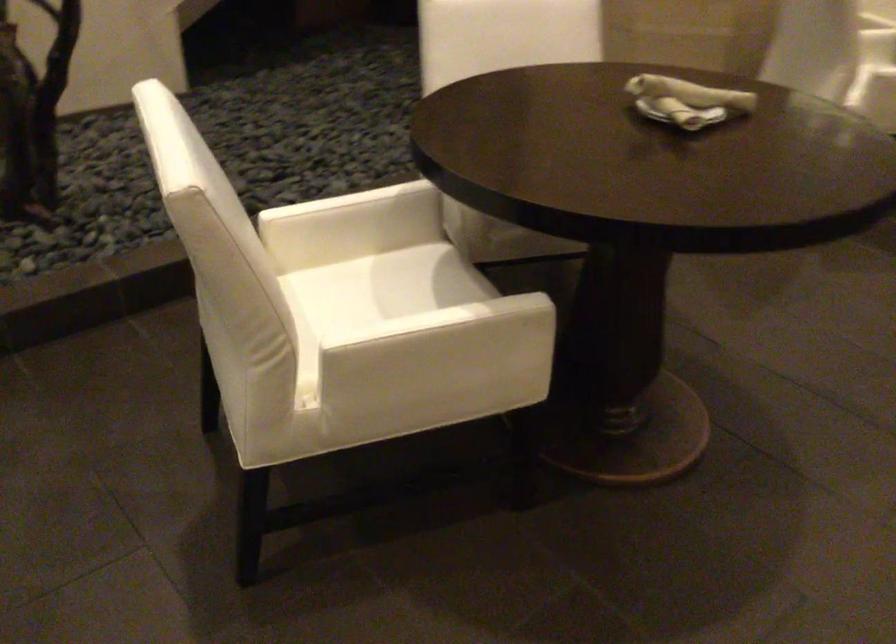
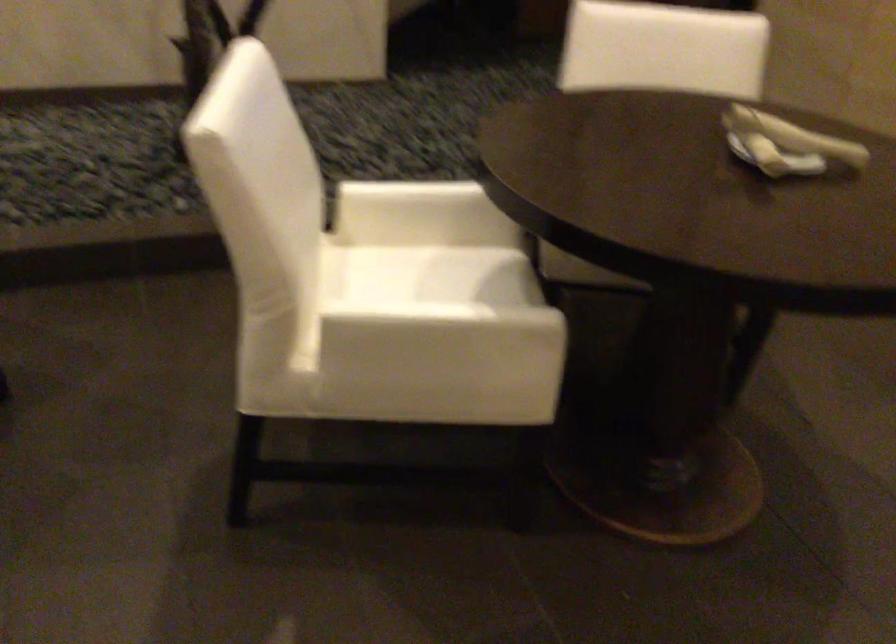
Locate, in the second image, the point that corresponds to the point at 356,276 in the first image.

(412, 261)